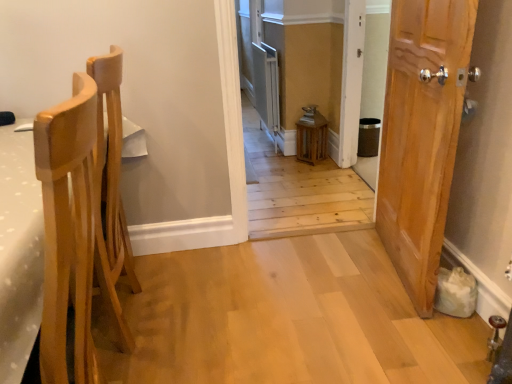
Question: Does light wood chair at left have a lesser height compared to wooden door at right?

Choices:
 (A) yes
 (B) no

Answer: (A)

Question: Is light wood chair at left facing towards wooden door at right?

Choices:
 (A) no
 (B) yes

Answer: (A)

Question: Is light wood chair at left to the right of wooden door at right from the viewer's perspective?

Choices:
 (A) no
 (B) yes

Answer: (A)

Question: From the image's perspective, is light wood chair at left above wooden door at right?

Choices:
 (A) no
 (B) yes

Answer: (A)

Question: Is light wood chair at left smaller than wooden door at right?

Choices:
 (A) yes
 (B) no

Answer: (B)

Question: Is light wood chair at left at the left side of wooden door at right?

Choices:
 (A) yes
 (B) no

Answer: (A)

Question: Is wooden door at right bigger than wooden lantern at center?

Choices:
 (A) no
 (B) yes

Answer: (B)

Question: Considering the relative positions of wooden door at right and wooden lantern at center in the image provided, is wooden door at right to the right of wooden lantern at center from the viewer's perspective?

Choices:
 (A) no
 (B) yes

Answer: (B)

Question: From a real-world perspective, is wooden door at right over wooden lantern at center?

Choices:
 (A) yes
 (B) no

Answer: (B)

Question: Is wooden door at right at the left side of wooden lantern at center?

Choices:
 (A) no
 (B) yes

Answer: (A)

Question: Can you confirm if wooden door at right is wider than wooden lantern at center?

Choices:
 (A) yes
 (B) no

Answer: (A)

Question: Considering the relative sizes of wooden door at right and wooden lantern at center in the image provided, is wooden door at right smaller than wooden lantern at center?

Choices:
 (A) yes
 (B) no

Answer: (B)

Question: Is light wood chair at left taller than wooden lantern at center?

Choices:
 (A) yes
 (B) no

Answer: (B)